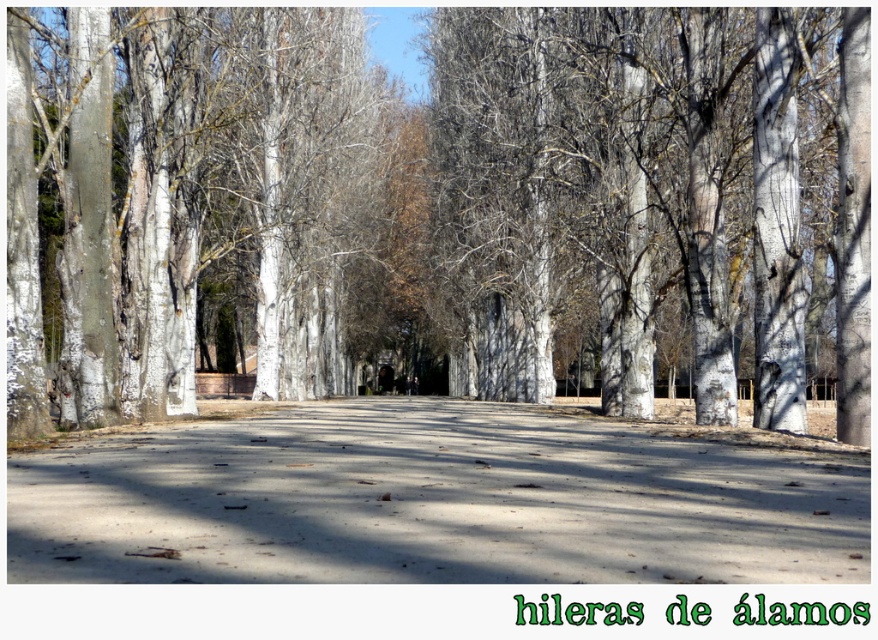
Is smooth white tree at center in front of smooth concrete path at center?

No, smooth white tree at center is further to the viewer.

Between point (177, 84) and point (414, 561), which one is positioned behind?

The point (177, 84) is more distant.

Image resolution: width=878 pixels, height=640 pixels. I want to click on smooth white tree at center, so click(x=440, y=202).

Identify the location of smooth white tree at center. (440, 202).

Image resolution: width=878 pixels, height=640 pixels. Describe the element at coordinates (440, 202) in the screenshot. I see `smooth white tree at center` at that location.

Does point (560, 188) come farther from viewer compared to point (157, 221)?

Yes.

Is point (621, 280) positioned before point (339, 259)?

Yes, it is.

What are the coordinates of `smooth white tree at center` in the screenshot? It's located at (440, 202).

Is smooth concrete path at center positioned behind white smooth tree at left?

No, it is not.

Who is higher up, smooth concrete path at center or white smooth tree at left?

white smooth tree at left is higher up.

The image size is (878, 640). I want to click on smooth concrete path at center, so click(430, 500).